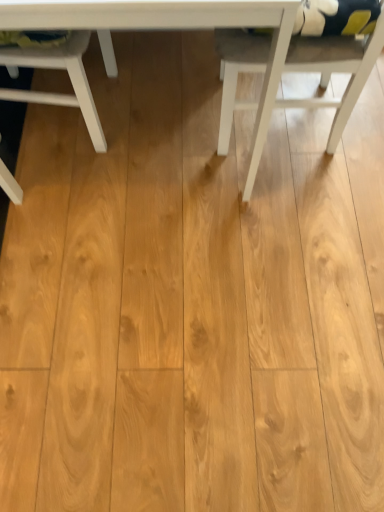
Question: Is point (8, 19) closer or farther from the camera than point (337, 140)?

Choices:
 (A) farther
 (B) closer

Answer: (B)

Question: Visually, is white wood table at center positioned to the left or to the right of white matte chair at right, placed as the 1th chair when sorted from right to left?

Choices:
 (A) left
 (B) right

Answer: (A)

Question: Considering the real-world distances, which object is farthest from the white matte chair at upper left, positioned as the first chair in left-to-right order?

Choices:
 (A) white wood table at center
 (B) white matte chair at right, which is the second chair in left-to-right order

Answer: (B)

Question: Considering the real-world distances, which object is closest to the white wood table at center?

Choices:
 (A) white matte chair at right, which is the second chair in left-to-right order
 (B) white matte chair at upper left, arranged as the second chair when viewed from the right

Answer: (A)